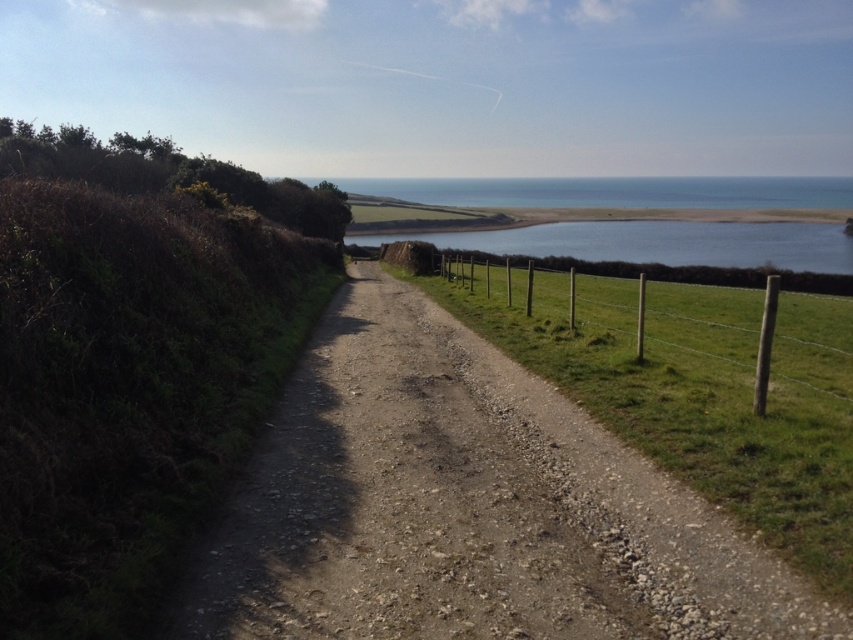
Is wooden post fence at right shorter than blue water at center?

Yes.

Measure the distance between point [740,321] and camera.

Point [740,321] is 75.71 feet away from camera.

Who is more forward, (682, 310) or (801, 253)?

Point (682, 310)

Image resolution: width=853 pixels, height=640 pixels. In order to click on wooden post fence at right in this screenshot , I will do `click(705, 332)`.

Is green grassy at right in front of blue water at center?

Yes, green grassy at right is in front of blue water at center.

Can you confirm if green grassy at right is positioned above blue water at center?

No.

Does point (454, 301) come in front of point (618, 257)?

Yes, it is in front of point (618, 257).

I want to click on green grassy at right, so click(701, 396).

Can you confirm if green grassy at right is positioned to the left of wooden post fence at right?

Indeed, green grassy at right is positioned on the left side of wooden post fence at right.

Which is in front, point (672, 404) or point (664, 356)?

Point (672, 404)

Image resolution: width=853 pixels, height=640 pixels. Identify the location of green grassy at right. (701, 396).